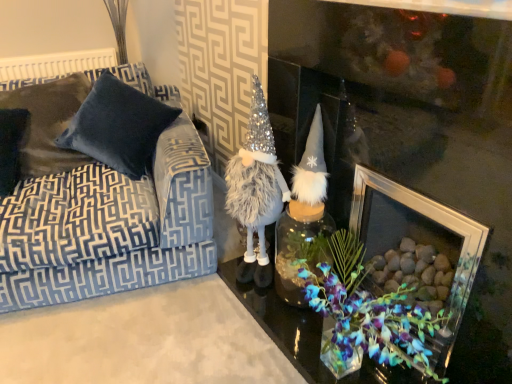
Question: From a real-world perspective, does fuzzy silver/grey gnome at center sit lower than clear glass picture frame at center?

Choices:
 (A) yes
 (B) no

Answer: (B)

Question: Are fuzzy silver/grey gnome at center and clear glass picture frame at center making contact?

Choices:
 (A) no
 (B) yes

Answer: (A)

Question: Does fuzzy silver/grey gnome at center lie in front of clear glass picture frame at center?

Choices:
 (A) yes
 (B) no

Answer: (B)

Question: Does fuzzy silver/grey gnome at center have a greater width compared to clear glass picture frame at center?

Choices:
 (A) no
 (B) yes

Answer: (A)

Question: From the image's perspective, is fuzzy silver/grey gnome at center beneath clear glass picture frame at center?

Choices:
 (A) yes
 (B) no

Answer: (B)

Question: Which is correct: clear glass picture frame at center is inside fuzzy silver/grey gnome at center, or outside of it?

Choices:
 (A) inside
 (B) outside

Answer: (B)

Question: From a real-world perspective, relative to fuzzy silver/grey gnome at center, is clear glass picture frame at center vertically above or below?

Choices:
 (A) below
 (B) above

Answer: (A)

Question: Looking at the image, does clear glass picture frame at center seem bigger or smaller compared to fuzzy silver/grey gnome at center?

Choices:
 (A) big
 (B) small

Answer: (A)

Question: In terms of width, does clear glass picture frame at center look wider or thinner when compared to fuzzy silver/grey gnome at center?

Choices:
 (A) thin
 (B) wide

Answer: (B)

Question: Looking at their shapes, would you say velvet blue couch at left is wider or thinner than clear glass picture frame at center?

Choices:
 (A) thin
 (B) wide

Answer: (B)

Question: Does point (181, 226) appear closer or farther from the camera than point (361, 187)?

Choices:
 (A) closer
 (B) farther

Answer: (B)

Question: From a real-world perspective, is velvet blue couch at left positioned above or below clear glass picture frame at center?

Choices:
 (A) below
 (B) above

Answer: (B)

Question: From the image's perspective, relative to clear glass picture frame at center, is velvet blue couch at left above or below?

Choices:
 (A) above
 (B) below

Answer: (A)

Question: Is velvet pillow at left, which is the 1th pillow in left-to-right order, inside or outside of fuzzy silver/grey gnome at center?

Choices:
 (A) inside
 (B) outside

Answer: (B)

Question: From a real-world perspective, relative to fuzzy silver/grey gnome at center, is velvet pillow at left, positioned as the 2th pillow in right-to-left order, vertically above or below?

Choices:
 (A) below
 (B) above

Answer: (B)